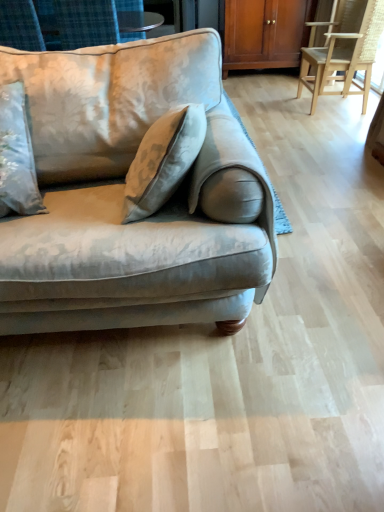
Where is `wooden cabinet at upper center`? This screenshot has height=512, width=384. wooden cabinet at upper center is located at coordinates (265, 33).

What do you see at coordinates (265, 33) in the screenshot? The image size is (384, 512). I see `wooden cabinet at upper center` at bounding box center [265, 33].

Identify the location of velvet beige couch at left. The width and height of the screenshot is (384, 512). (123, 195).

Is wooden cabinet at upper center looking in the opposite direction of light brown wooden chair at right?

wooden cabinet at upper center does not have its back to light brown wooden chair at right.

This screenshot has width=384, height=512. What are the coordinates of `chair below the wooden cabinet at upper center (from the image's perspective)` in the screenshot? It's located at [x=343, y=49].

Can light brown wooden chair at right be found inside wooden cabinet at upper center?

No, light brown wooden chair at right is located outside of wooden cabinet at upper center.

Could you tell me if light brown wooden chair at right is facing velvet beige couch at left?

No, light brown wooden chair at right is not oriented towards velvet beige couch at left.

Does light brown wooden chair at right lie in front of velvet beige couch at left?

No, light brown wooden chair at right is further to the viewer.

Which of these two, light brown wooden chair at right or velvet beige couch at left, is bigger?

With larger size is velvet beige couch at left.

This screenshot has width=384, height=512. In the image, there is a velvet beige couch at left. What are the coordinates of `chair below it (from a real-world perspective)` in the screenshot? It's located at (343, 49).

Are velvet beige couch at left and light brown wooden chair at right beside each other?

velvet beige couch at left is not next to light brown wooden chair at right, and they're not touching.

Looking at this image, which object is positioned more to the right, velvet beige couch at left or light brown wooden chair at right?

light brown wooden chair at right is more to the right.

Does velvet beige couch at left turn towards light brown wooden chair at right?

No, velvet beige couch at left is not facing towards light brown wooden chair at right.

Where is `studio couch above the wooden cabinet at upper center (from a real-world perspective)`? This screenshot has height=512, width=384. studio couch above the wooden cabinet at upper center (from a real-world perspective) is located at coordinates (123, 195).

Is wooden cabinet at upper center positioned before velvet beige couch at left?

No, wooden cabinet at upper center is further to the viewer.

From the image's perspective, which is below, wooden cabinet at upper center or velvet beige couch at left?

velvet beige couch at left is shown below in the image.

How many degrees apart are the facing directions of wooden cabinet at upper center and velvet beige couch at left?

The angle between the facing direction of wooden cabinet at upper center and the facing direction of velvet beige couch at left is 2 degrees.

Which is less distant, (111, 71) or (269, 32)?

Point (111, 71).

Who is shorter, velvet beige couch at left or wooden cabinet at upper center?

Standing shorter between the two is wooden cabinet at upper center.

From the image's perspective, which one is positioned higher, velvet beige couch at left or wooden cabinet at upper center?

wooden cabinet at upper center is shown above in the image.

In the scene shown: Considering the sizes of light brown wooden chair at right and wooden cabinet at upper center in the image, is light brown wooden chair at right wider or thinner than wooden cabinet at upper center?

Considering their sizes, light brown wooden chair at right looks slimmer than wooden cabinet at upper center.

Do you think light brown wooden chair at right is within wooden cabinet at upper center, or outside of it?

light brown wooden chair at right is located beyond the bounds of wooden cabinet at upper center.

I want to click on chair located above the wooden cabinet at upper center (from a real-world perspective), so click(x=343, y=49).

Would you consider light brown wooden chair at right to be distant from wooden cabinet at upper center?

That's not correct — light brown wooden chair at right is a little close to wooden cabinet at upper center.

You are a GUI agent. You are given a task and a screenshot of the screen. Output one action in this format:
    pyautogui.click(x=<x>, y=<y>)
    Task: Click on the chair located on the right of wooden cabinet at upper center
    Image resolution: width=384 pixels, height=512 pixels.
    Given the screenshot: What is the action you would take?
    pyautogui.click(x=343, y=49)

This screenshot has width=384, height=512. I want to click on studio couch positioned vertically above the light brown wooden chair at right (from a real-world perspective), so click(123, 195).

Considering their positions, is velvet beige couch at left positioned closer to light brown wooden chair at right than wooden cabinet at upper center?

wooden cabinet at upper center lies closer to light brown wooden chair at right than the other object.

Based on their spatial positions, is wooden cabinet at upper center or velvet beige couch at left further from light brown wooden chair at right?

Among the two, velvet beige couch at left is located further to light brown wooden chair at right.

Looking at the image, which one is located closer to velvet beige couch at left, wooden cabinet at upper center or light brown wooden chair at right?

light brown wooden chair at right.

From the image, which object appears to be nearer to wooden cabinet at upper center, light brown wooden chair at right or velvet beige couch at left?

light brown wooden chair at right lies closer to wooden cabinet at upper center than the other object.

Consider the image. Estimate the real-world distances between objects in this image. Which object is closer to velvet beige couch at left, light brown wooden chair at right or wooden cabinet at upper center?

light brown wooden chair at right is positioned closer to the anchor velvet beige couch at left.

Based on their spatial positions, is velvet beige couch at left or light brown wooden chair at right closer to wooden cabinet at upper center?

Based on the image, light brown wooden chair at right appears to be nearer to wooden cabinet at upper center.

Image resolution: width=384 pixels, height=512 pixels. Find the location of `chair between velvet beige couch at left and wooden cabinet at upper center in the front-back direction`. chair between velvet beige couch at left and wooden cabinet at upper center in the front-back direction is located at coordinates (343, 49).